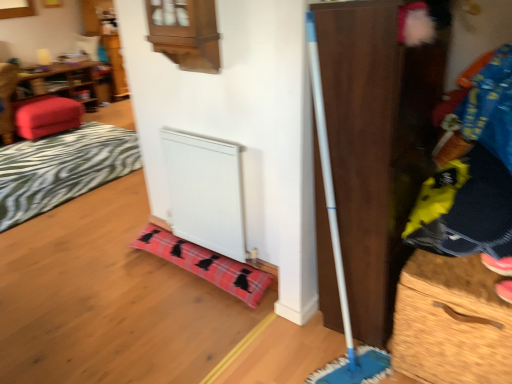
Question: Is wooden dresser at right located outside plaid fabric blanket at lower center, arranged as the 1th blanket when viewed from the front?

Choices:
 (A) no
 (B) yes

Answer: (B)

Question: From the image's perspective, is wooden dresser at right located above plaid fabric blanket at lower center, which ranks as the 1th blanket in bottom-to-top order?

Choices:
 (A) yes
 (B) no

Answer: (A)

Question: Are wooden dresser at right and plaid fabric blanket at lower center, positioned as the 1th blanket in right-to-left order, far apart?

Choices:
 (A) yes
 (B) no

Answer: (B)

Question: Can you confirm if wooden dresser at right is thinner than plaid fabric blanket at lower center, which is counted as the second blanket, starting from the back?

Choices:
 (A) yes
 (B) no

Answer: (B)

Question: Is wooden dresser at right bigger than plaid fabric blanket at lower center, arranged as the 1th blanket when viewed from the front?

Choices:
 (A) no
 (B) yes

Answer: (B)

Question: Choose the correct answer: Is wooden drawer at right inside wooden dresser at right or outside it?

Choices:
 (A) outside
 (B) inside

Answer: (A)

Question: From a real-world perspective, is wooden drawer at right positioned above or below wooden dresser at right?

Choices:
 (A) above
 (B) below

Answer: (B)

Question: Relative to wooden dresser at right, is wooden drawer at right in front or behind?

Choices:
 (A) front
 (B) behind

Answer: (B)

Question: Is point (426, 284) positioned closer to the camera than point (423, 100)?

Choices:
 (A) farther
 (B) closer

Answer: (B)

Question: Considering the positions of pink suede shoe at lower right and plaid fabric blanket at lower left, which ranks as the 1th blanket in left-to-right order, in the image, is pink suede shoe at lower right bigger or smaller than plaid fabric blanket at lower left, which ranks as the 1th blanket in left-to-right order,?

Choices:
 (A) big
 (B) small

Answer: (B)

Question: Would you say pink suede shoe at lower right is inside or outside plaid fabric blanket at lower left, which ranks as the 1th blanket in left-to-right order?

Choices:
 (A) inside
 (B) outside

Answer: (B)

Question: From a real-world perspective, is pink suede shoe at lower right positioned above or below plaid fabric blanket at lower left, which ranks as the second blanket in bottom-to-top order?

Choices:
 (A) below
 (B) above

Answer: (B)

Question: In the image, is pink suede shoe at lower right positioned in front of or behind plaid fabric blanket at lower left, which is the 2th blanket in right-to-left order?

Choices:
 (A) behind
 (B) front

Answer: (B)

Question: From a real-world perspective, is white matte radiator at lower center positioned above or below matte red ottoman at left?

Choices:
 (A) above
 (B) below

Answer: (A)

Question: Looking at their shapes, would you say white matte radiator at lower center is wider or thinner than matte red ottoman at left?

Choices:
 (A) thin
 (B) wide

Answer: (A)